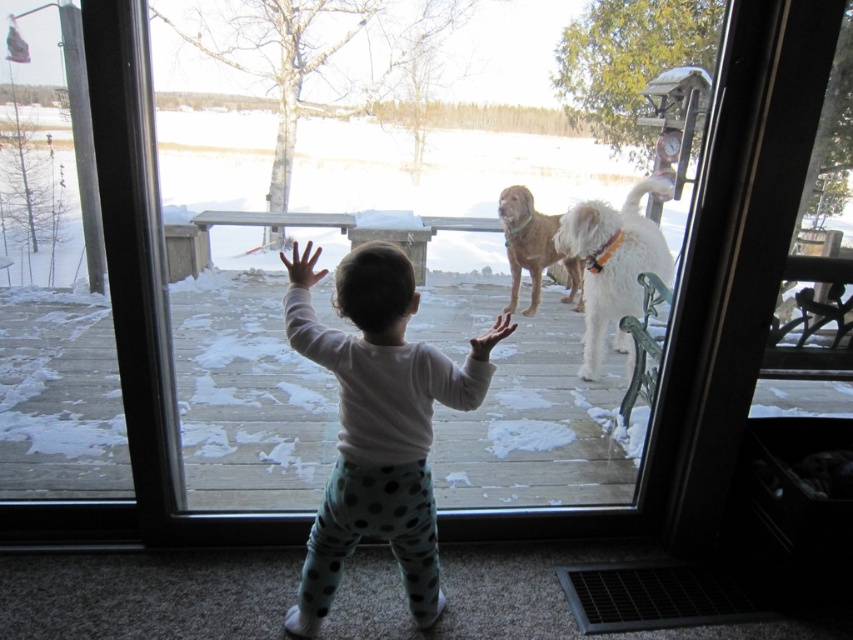
Question: Which of the following is the farthest from the observer?

Choices:
 (A) white fluffy dog at right
 (B) white soft toddler at center
 (C) transparent glass window at center

Answer: (A)

Question: Is white soft toddler at center below golden brown fur at center?

Choices:
 (A) yes
 (B) no

Answer: (A)

Question: Is transparent glass window at center wider than white soft toddler at center?

Choices:
 (A) no
 (B) yes

Answer: (B)

Question: Does transparent glass window at center appear on the left side of golden brown fur at center?

Choices:
 (A) no
 (B) yes

Answer: (B)

Question: Among these points, which one is farthest from the camera?

Choices:
 (A) (566, 232)
 (B) (590, 534)
 (C) (503, 221)

Answer: (C)

Question: Based on their relative distances, which object is farther from the white fluffy dog at right?

Choices:
 (A) white soft toddler at center
 (B) golden brown fur at center

Answer: (A)